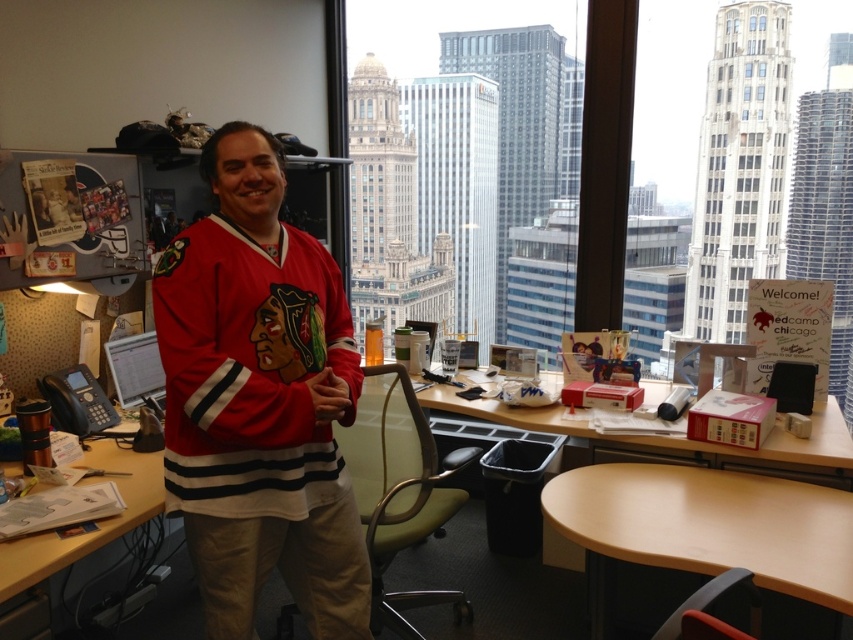
You are organizing a meeting in the office and need to place a large presentation screen. The screen requires a flat surface that is behind the light brown wood table at lower right. Can the wooden desk at center be used for this purpose?

The light brown wood table at lower right is in front of the wooden desk at center, so the wooden desk at center is behind the light brown wood table at lower right. Therefore, the wooden desk at center can be used as the flat surface behind the light brown wood table at lower right for placing the large presentation screen.

You are an office worker who needs to place a new monitor on the tallest surface available. Which object between the light brown wood table at lower right and the wooden desk at center should you choose?

The wooden desk at center is taller than the light brown wood table at lower right, so you should choose the wooden desk at center to place the new monitor.

You are an office worker who needs to hang a new poster on the wall. You have a matte jersey at center and a wooden desk at center in your view. Which object should you move to access the wall space above them?

The matte jersey at center is taller than the wooden desk at center, so you should move the matte jersey at center to access the wall space above them.